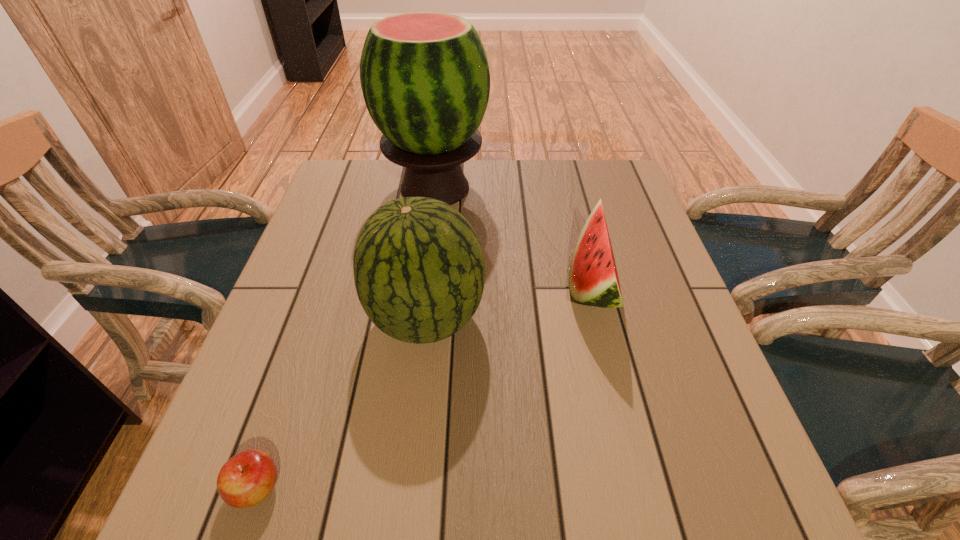
Find the location of a particular element. The height and width of the screenshot is (540, 960). vacant space that satisfies the following two spatial constraints: 1. on the outer rind of the rightmost watermelon; 2. on the front side of the second tallest object is located at coordinates (601, 319).

Identify the location of free spot that satisfies the following two spatial constraints: 1. on the back side of the apple; 2. on the left side of the third shortest object. The width and height of the screenshot is (960, 540). (314, 319).